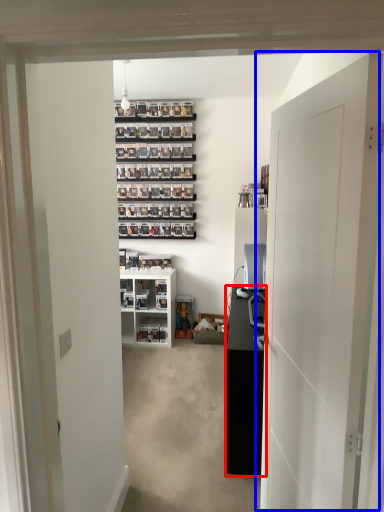
Question: Which object appears farthest to the camera in this image, cabinetry (highlighted by a red box) or door (highlighted by a blue box)?

Choices:
 (A) cabinetry
 (B) door

Answer: (A)